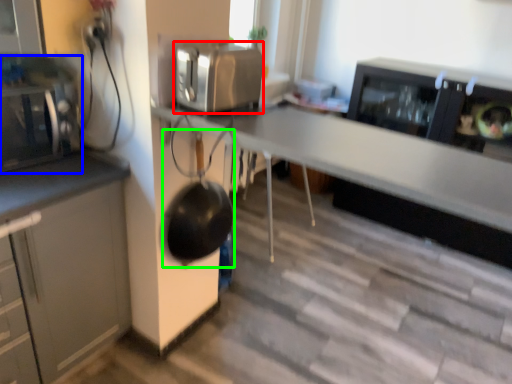
Question: Estimate the real-world distances between objects in this image. Which object is closer to kitchen appliance (highlighted by a red box), home appliance (highlighted by a blue box) or wok (highlighted by a green box)?

Choices:
 (A) home appliance
 (B) wok

Answer: (B)